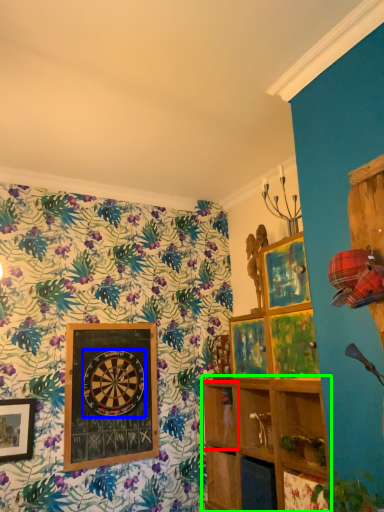
Question: Which object is positioned farthest from shelf (highlighted by a red box)? Select from design (highlighted by a blue box) and shelf (highlighted by a green box).

Choices:
 (A) design
 (B) shelf

Answer: (A)